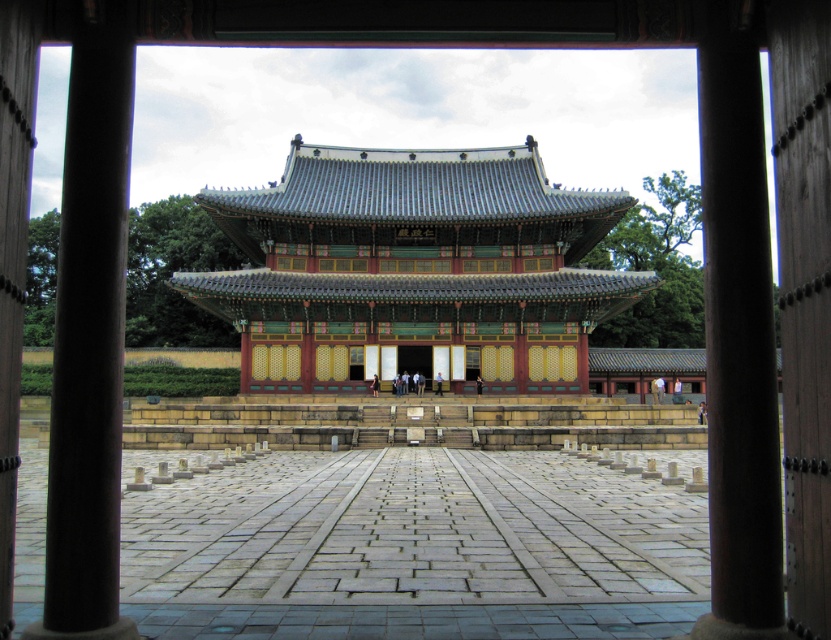
Question: Estimate the real-world distances between objects in this image. Which object is closer to the brown polished wood pillar at left?

Choices:
 (A) brown wood pillar at right
 (B) polished wood palace at center

Answer: (A)

Question: Observing the image, what is the correct spatial positioning of polished wood palace at center in reference to brown polished wood pillar at left?

Choices:
 (A) left
 (B) right

Answer: (B)

Question: From the image, what is the correct spatial relationship of polished wood palace at center in relation to brown wood pillar at right?

Choices:
 (A) below
 (B) above

Answer: (B)

Question: Considering the relative positions of polished wood palace at center and brown polished wood pillar at left in the image provided, where is polished wood palace at center located with respect to brown polished wood pillar at left?

Choices:
 (A) right
 (B) left

Answer: (A)

Question: Which object is the closest to the brown polished wood pillar at left?

Choices:
 (A) brown wood pillar at right
 (B) polished wood palace at center

Answer: (A)

Question: Which point is closer to the camera?

Choices:
 (A) (77, 285)
 (B) (761, 289)

Answer: (A)